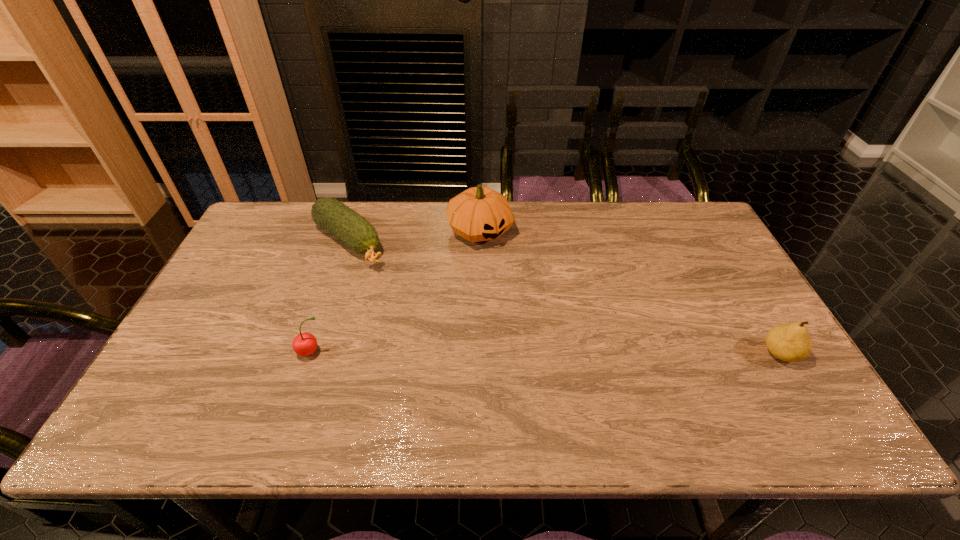
You are a GUI agent. You are given a task and a screenshot of the screen. Output one action in this format:
    pyautogui.click(x=<x>, y=<y>)
    Task: Click on the cherry
    The height and width of the screenshot is (540, 960).
    Given the screenshot: What is the action you would take?
    pyautogui.click(x=304, y=344)

This screenshot has width=960, height=540. In order to click on the rightmost object in this screenshot , I will do `click(789, 342)`.

What are the coordinates of `gourd` in the screenshot? It's located at (479, 213).

Identify the location of the tallest object. This screenshot has width=960, height=540. (479, 213).

This screenshot has height=540, width=960. In order to click on the shortest object in this screenshot , I will do `click(354, 230)`.

Locate an element on the screen. The width and height of the screenshot is (960, 540). free space located on the back of the cherry is located at coordinates (329, 300).

Where is `free point located on the left of the rightmost object`? This screenshot has height=540, width=960. free point located on the left of the rightmost object is located at coordinates (613, 353).

In order to click on free location located 0.310m on the side of the second object from right to left with the carved face in this screenshot , I will do `click(558, 314)`.

The width and height of the screenshot is (960, 540). In order to click on blank space located 0.180m on the side of the second object from right to left with the carved face in this screenshot , I will do click(530, 285).

Where is `vacant area situated on the side of the second object from right to left with the carved face`? This screenshot has width=960, height=540. vacant area situated on the side of the second object from right to left with the carved face is located at coordinates (508, 260).